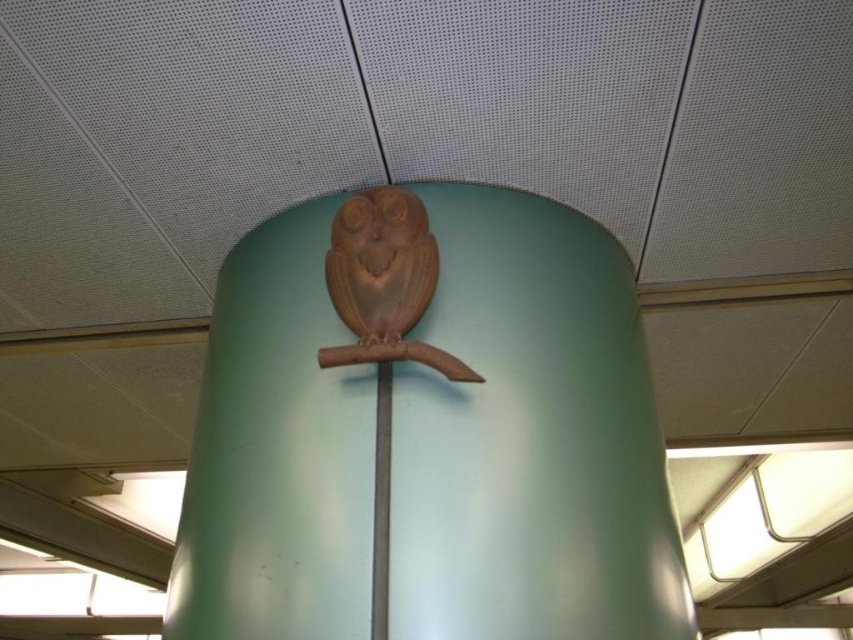
Question: Can you confirm if matte wood owl at center is positioned below wooden owl at center?

Choices:
 (A) no
 (B) yes

Answer: (B)

Question: Which point is farther to the camera?

Choices:
 (A) matte wood owl at center
 (B) metallic silver pole at center

Answer: (A)

Question: Which point appears closest to the camera in this image?

Choices:
 (A) (387, 468)
 (B) (378, 298)
 (C) (184, 566)

Answer: (A)

Question: Which point is farther to the camera?

Choices:
 (A) (381, 449)
 (B) (354, 228)

Answer: (B)

Question: Considering the relative positions of matte wood owl at center and metallic silver pole at center in the image provided, where is matte wood owl at center located with respect to metallic silver pole at center?

Choices:
 (A) right
 (B) left

Answer: (A)

Question: Does matte wood owl at center come behind metallic silver pole at center?

Choices:
 (A) no
 (B) yes

Answer: (B)